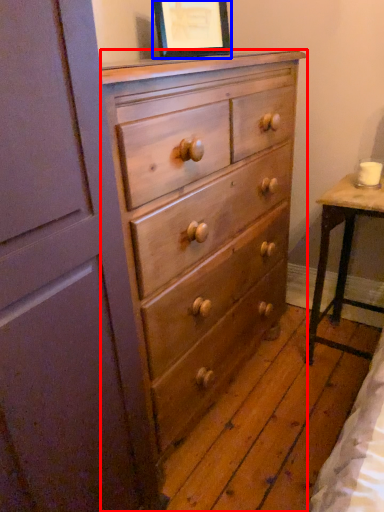
Question: Among these objects, which one is nearest to the camera, chest of drawers (highlighted by a red box) or picture frame (highlighted by a blue box)?

Choices:
 (A) chest of drawers
 (B) picture frame

Answer: (A)